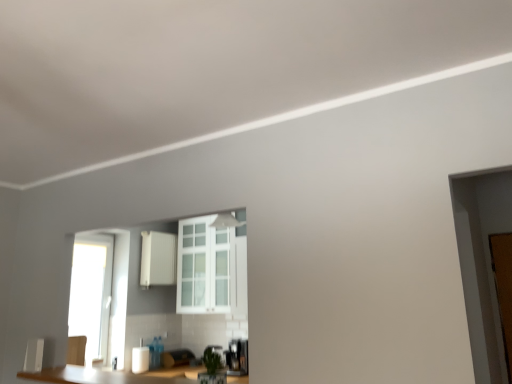
Question: From a real-world perspective, is white matte cabinet at center beneath white glass cabinet at center?

Choices:
 (A) yes
 (B) no

Answer: (B)

Question: Is white matte cabinet at center directly adjacent to white glass cabinet at center?

Choices:
 (A) yes
 (B) no

Answer: (B)

Question: From a real-world perspective, is white matte cabinet at center positioned over white glass cabinet at center based on gravity?

Choices:
 (A) no
 (B) yes

Answer: (B)

Question: Does white matte cabinet at center appear on the right side of white glass cabinet at center?

Choices:
 (A) yes
 (B) no

Answer: (B)

Question: Is white matte cabinet at center oriented towards white glass cabinet at center?

Choices:
 (A) yes
 (B) no

Answer: (A)

Question: Considering the positions of white glossy paper towel dispenser at lower center and brown wooden door at right in the image, is white glossy paper towel dispenser at lower center taller or shorter than brown wooden door at right?

Choices:
 (A) short
 (B) tall

Answer: (A)

Question: Is white glossy paper towel dispenser at lower center to the left or to the right of brown wooden door at right in the image?

Choices:
 (A) left
 (B) right

Answer: (A)

Question: From a real-world perspective, is white glossy paper towel dispenser at lower center above or below brown wooden door at right?

Choices:
 (A) above
 (B) below

Answer: (B)

Question: From the image's perspective, is white glossy paper towel dispenser at lower center positioned above or below brown wooden door at right?

Choices:
 (A) above
 (B) below

Answer: (B)

Question: Is white matte cabinet at center wider or thinner than brown wooden door at right?

Choices:
 (A) wide
 (B) thin

Answer: (A)

Question: In the image, is white matte cabinet at center on the left side or the right side of brown wooden door at right?

Choices:
 (A) right
 (B) left

Answer: (B)

Question: From a real-world perspective, is white matte cabinet at center positioned above or below brown wooden door at right?

Choices:
 (A) above
 (B) below

Answer: (A)

Question: Considering the positions of white matte cabinet at center and brown wooden door at right in the image, is white matte cabinet at center bigger or smaller than brown wooden door at right?

Choices:
 (A) small
 (B) big

Answer: (B)

Question: From the image's perspective, is brown wooden door at right positioned above or below white glossy paper towel dispenser at lower center?

Choices:
 (A) below
 (B) above

Answer: (B)

Question: Considering the relative positions of brown wooden door at right and white glossy paper towel dispenser at lower center in the image provided, is brown wooden door at right to the left or to the right of white glossy paper towel dispenser at lower center?

Choices:
 (A) right
 (B) left

Answer: (A)